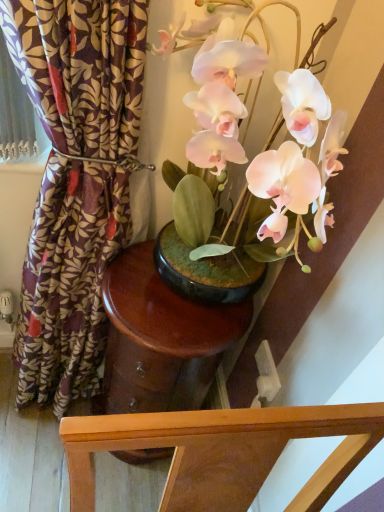
Question: Is white plastic power outlet at lower right taller than matte pink orchid at center?

Choices:
 (A) no
 (B) yes

Answer: (A)

Question: Does white plastic power outlet at lower right have a smaller size compared to matte pink orchid at center?

Choices:
 (A) yes
 (B) no

Answer: (A)

Question: Considering the relative positions of white plastic power outlet at lower right and matte pink orchid at center in the image provided, is white plastic power outlet at lower right to the left of matte pink orchid at center from the viewer's perspective?

Choices:
 (A) no
 (B) yes

Answer: (A)

Question: Is white plastic power outlet at lower right next to matte pink orchid at center and touching it?

Choices:
 (A) no
 (B) yes

Answer: (A)

Question: Is white plastic power outlet at lower right behind matte pink orchid at center?

Choices:
 (A) yes
 (B) no

Answer: (A)

Question: Can you confirm if white plastic power outlet at lower right is thinner than matte pink orchid at center?

Choices:
 (A) yes
 (B) no

Answer: (A)

Question: From a real-world perspective, is purple floral fabric at left below matte pink orchid at center?

Choices:
 (A) yes
 (B) no

Answer: (A)

Question: Is purple floral fabric at left not close to matte pink orchid at center?

Choices:
 (A) yes
 (B) no

Answer: (B)

Question: Does purple floral fabric at left have a smaller size compared to matte pink orchid at center?

Choices:
 (A) yes
 (B) no

Answer: (B)

Question: Does purple floral fabric at left contain matte pink orchid at center?

Choices:
 (A) no
 (B) yes

Answer: (A)

Question: Is purple floral fabric at left completely or partially outside of matte pink orchid at center?

Choices:
 (A) yes
 (B) no

Answer: (A)

Question: Can you confirm if purple floral fabric at left is bigger than matte pink orchid at center?

Choices:
 (A) no
 (B) yes

Answer: (B)

Question: Can you confirm if glossy wood side table at center is positioned to the left of purple floral fabric at left?

Choices:
 (A) no
 (B) yes

Answer: (A)